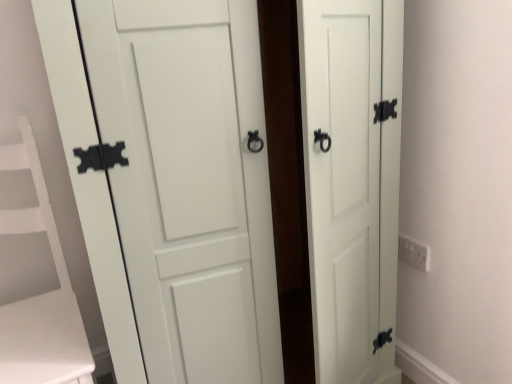
Question: Is white plastic electric outlet at right in front of or behind white matte door at center in the image?

Choices:
 (A) behind
 (B) front

Answer: (A)

Question: Is white plastic electric outlet at right taller or shorter than white matte door at center?

Choices:
 (A) short
 (B) tall

Answer: (A)

Question: Estimate the real-world distances between objects in this image. Which object is closer to the white plastic electric outlet at right?

Choices:
 (A) white matte vanity at left
 (B) white matte door at center

Answer: (B)

Question: Considering the real-world distances, which object is farthest from the white matte vanity at left?

Choices:
 (A) white plastic electric outlet at right
 (B) white matte door at center

Answer: (A)